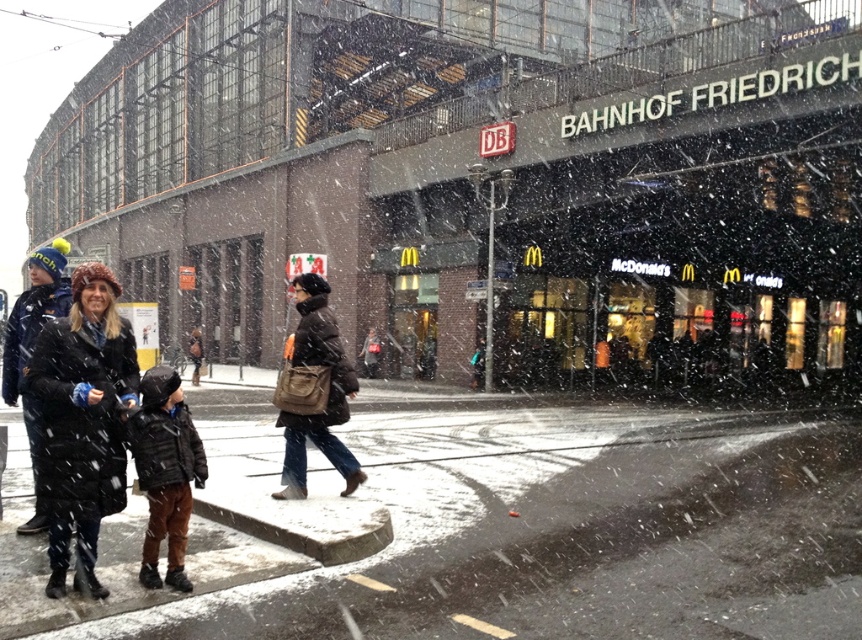
Question: Is smooth concrete sidewalk at center to the left of dark brown leather jacket at center from the viewer's perspective?

Choices:
 (A) yes
 (B) no

Answer: (A)

Question: Estimate the real-world distances between objects in this image. Which object is farther from the black puffy coat at center?

Choices:
 (A) smooth concrete sidewalk at center
 (B) dark brown leather jacket at lower left

Answer: (A)

Question: Which point is closer to the camera taking this photo?

Choices:
 (A) (298, 467)
 (B) (73, 524)
 (C) (176, 525)
 (D) (363, 538)

Answer: (B)

Question: Which of the following is the closest to the observer?

Choices:
 (A) black puffy coat at center
 (B) smooth concrete sidewalk at center
 (C) dark brown leather jacket at lower left
 (D) dark brown leather jacket at center

Answer: (B)

Question: From the image, what is the correct spatial relationship of dark brown leather jacket at lower left in relation to dark brown leather jacket at center?

Choices:
 (A) above
 (B) below

Answer: (B)

Question: Observing the image, what is the correct spatial positioning of black puffy coat at center in reference to dark brown leather jacket at center?

Choices:
 (A) right
 (B) left

Answer: (B)